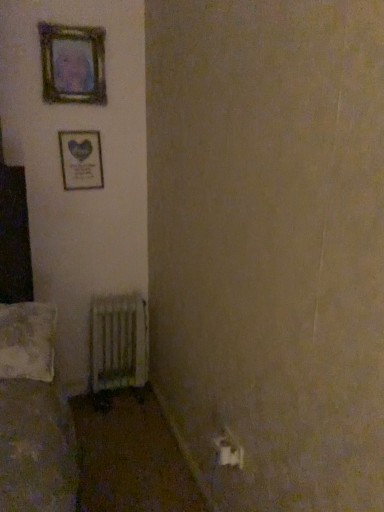
Question: From a real-world perspective, relative to wooden frame at upper left, placed as the second picture frame when sorted from top to bottom, is white textured pillow at lower left vertically above or below?

Choices:
 (A) below
 (B) above

Answer: (A)

Question: Considering the positions of white textured pillow at lower left and wooden frame at upper left, which ranks as the 1th picture frame in bottom-to-top order, in the image, is white textured pillow at lower left wider or thinner than wooden frame at upper left, which ranks as the 1th picture frame in bottom-to-top order,?

Choices:
 (A) wide
 (B) thin

Answer: (A)

Question: Estimate the real-world distances between objects in this image. Which object is farther from the wooden frame at upper left, which ranks as the 1th picture frame in bottom-to-top order?

Choices:
 (A) white plastic electric outlet at lower right
 (B) wooden frame at upper left, the first picture frame from the top
 (C) white textured pillow at lower left
 (D) metallic radiator at lower left

Answer: (A)

Question: Estimate the real-world distances between objects in this image. Which object is farther from the white plastic electric outlet at lower right?

Choices:
 (A) wooden frame at upper left, the first picture frame from the top
 (B) metallic radiator at lower left
 (C) white textured pillow at lower left
 (D) wooden frame at upper left, placed as the second picture frame when sorted from top to bottom

Answer: (A)